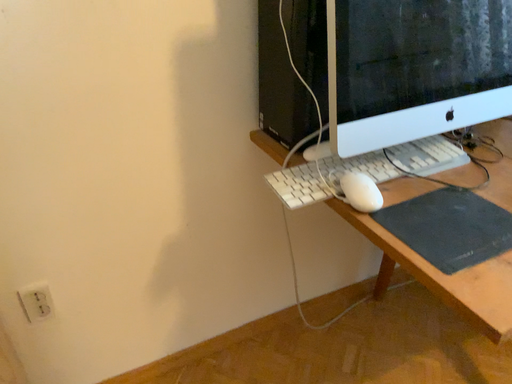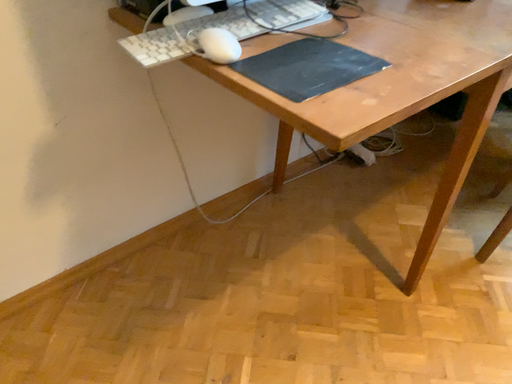
Question: Which way did the camera rotate in the video?

Choices:
 (A) rotated left
 (B) rotated right

Answer: (B)